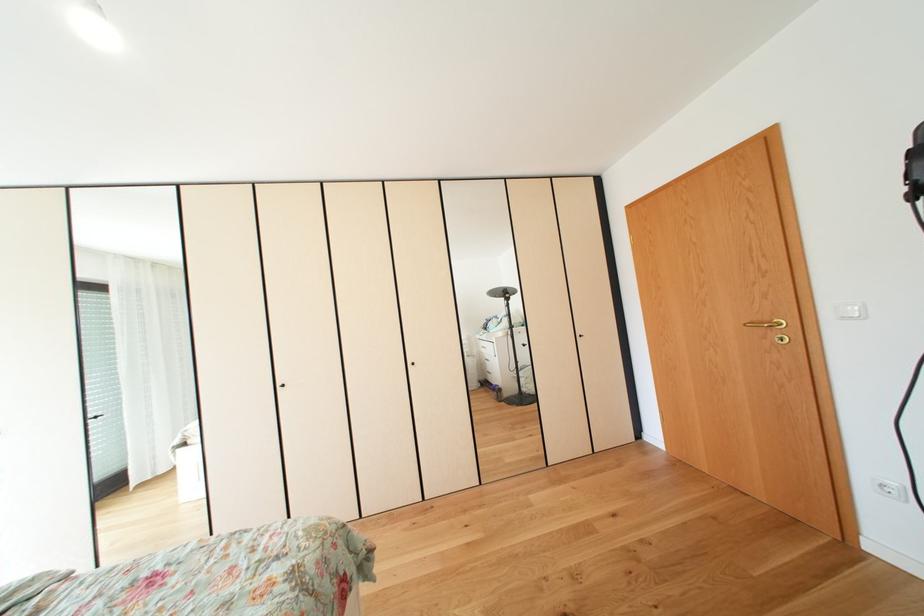
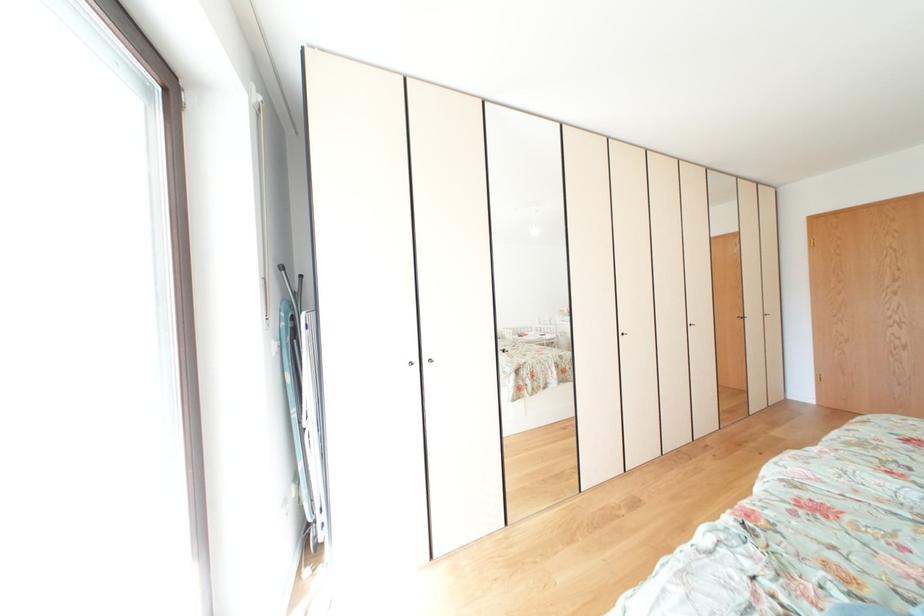
Question: In a continuous first-person perspective shot, in which direction is the camera moving?

Choices:
 (A) Left
 (B) Right
 (C) Forward
 (D) Backward

Answer: (A)